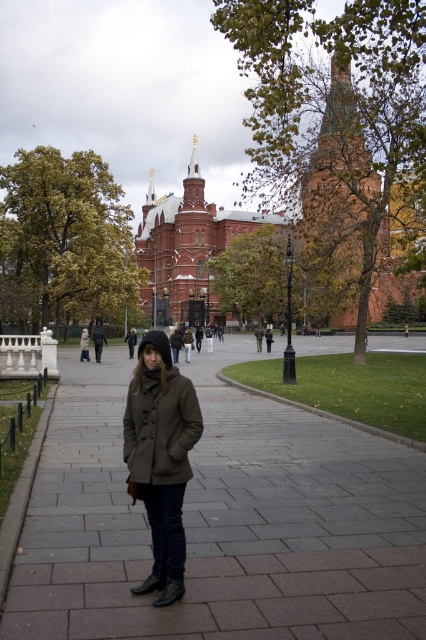
Is smooth concrete pavement at center below olive green wool coat at center?

Yes, smooth concrete pavement at center is below olive green wool coat at center.

Does smooth concrete pavement at center have a smaller size compared to olive green wool coat at center?

Actually, smooth concrete pavement at center might be larger than olive green wool coat at center.

The height and width of the screenshot is (640, 426). Find the location of `smooth concrete pavement at center`. smooth concrete pavement at center is located at coordinates (221, 522).

Is the position of matte brown coat at center less distant than that of olive green wool coat at center?

Yes.

Consider the image. Is the position of matte brown coat at center more distant than that of olive green wool coat at center?

No, it is in front of olive green wool coat at center.

Locate an element on the screen. matte brown coat at center is located at coordinates (161, 458).

Between point (164, 532) and point (85, 352), which one is positioned in front?

Point (164, 532)

Can you confirm if matte brown coat at center is thinner than brown woolen coat at center?

No.

Between point (155, 490) and point (83, 344), which one is positioned behind?

Positioned behind is point (83, 344).

Find the location of a particular element. This screenshot has width=426, height=640. matte brown coat at center is located at coordinates (161, 458).